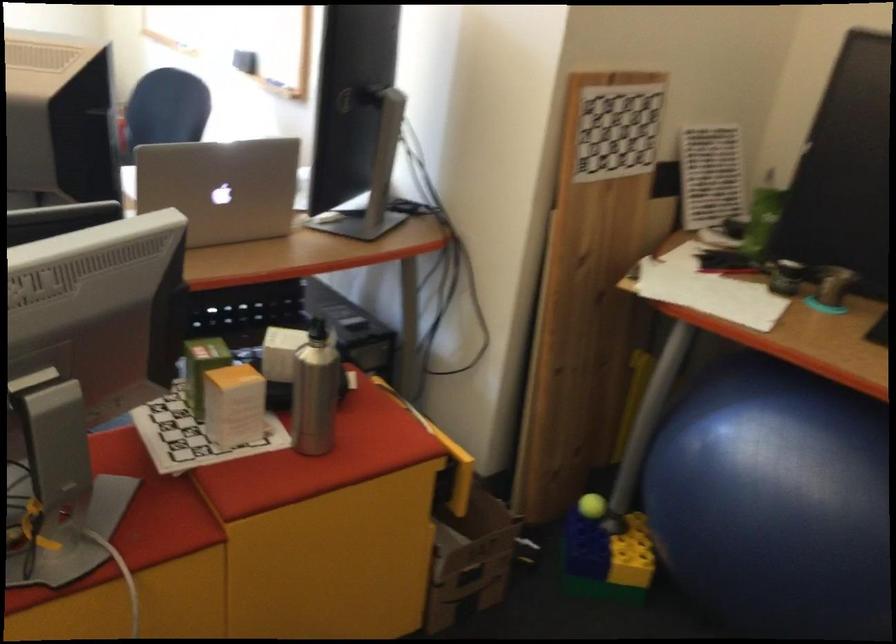
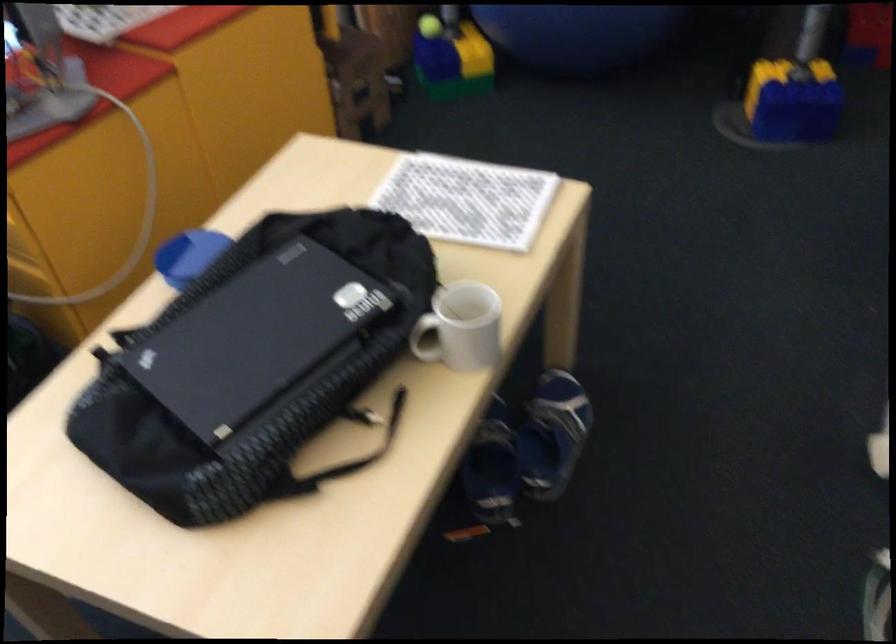
In the second image, find the point that corresponds to (583,500) in the first image.

(428, 26)